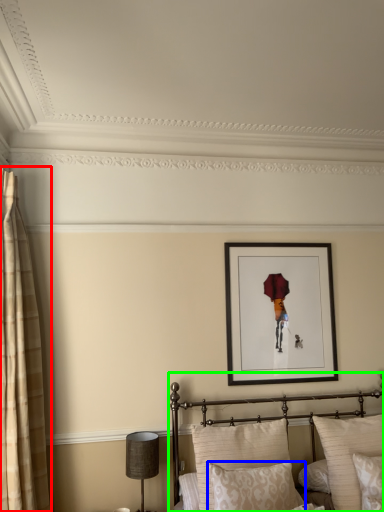
Question: Considering the real-world distances, which object is closest to curtain (highlighted by a red box)? pillow (highlighted by a blue box) or bed (highlighted by a green box).

Choices:
 (A) pillow
 (B) bed

Answer: (B)